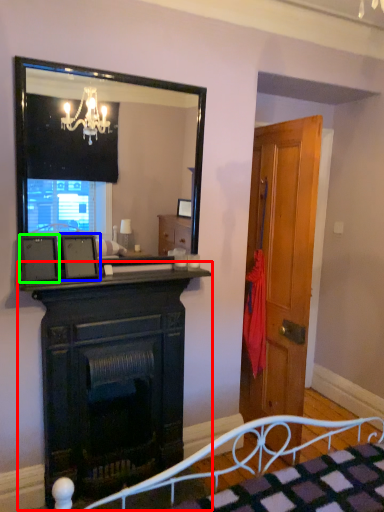
Question: Which object is positioned closest to fireplace (highlighted by a red box)? Select from picture frame (highlighted by a blue box) and picture frame (highlighted by a green box).

Choices:
 (A) picture frame
 (B) picture frame

Answer: (A)